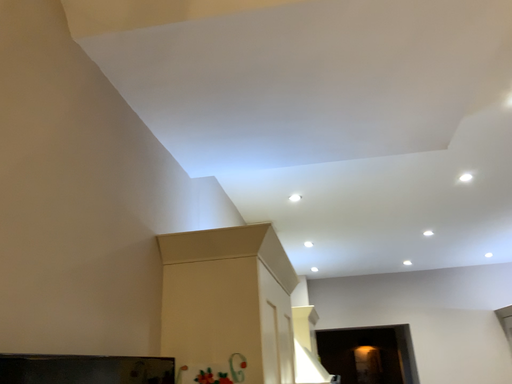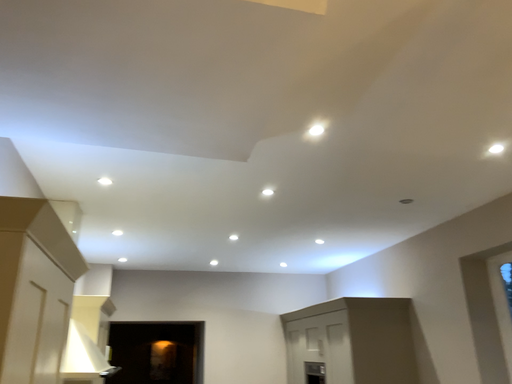
Question: Which way did the camera rotate in the video?

Choices:
 (A) rotated left
 (B) rotated right

Answer: (B)